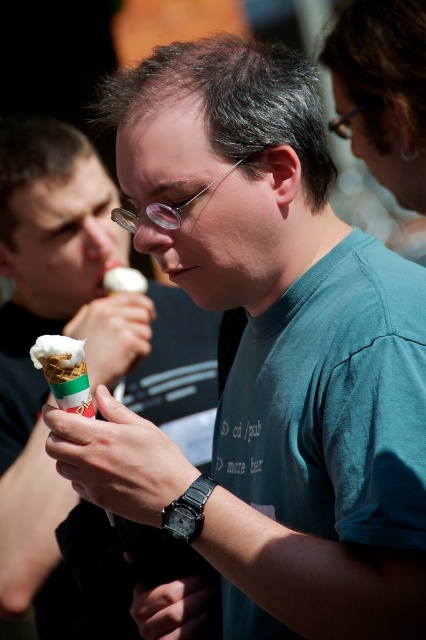
Between clear plastic glasses at center and white creamy ice cream at center, which one is positioned lower?

white creamy ice cream at center is lower down.

Is clear plastic glasses at center taller than white creamy ice cream at center?

Correct, clear plastic glasses at center is much taller as white creamy ice cream at center.

Describe the element at coordinates (183, 202) in the screenshot. The width and height of the screenshot is (426, 640). I see `clear plastic glasses at center` at that location.

At what (x,y) coordinates should I click in order to perform the action: click on clear plastic glasses at center. Please return your answer as a coordinate pair (x, y). The height and width of the screenshot is (640, 426). Looking at the image, I should click on (183, 202).

Is white creamy ice cream cone at left positioned at the back of white creamy ice cream at lower left?

That is True.

Does point (103, 253) come in front of point (80, 362)?

No, it is not.

Where is `white creamy ice cream cone at left`? This screenshot has height=640, width=426. white creamy ice cream cone at left is located at coordinates (86, 349).

Is point (135, 628) less distant than point (112, 289)?

Yes, it is in front of point (112, 289).

Can you confirm if white creamy ice cream cone at left is positioned to the right of white creamy ice cream at center?

In fact, white creamy ice cream cone at left is to the left of white creamy ice cream at center.

Does point (37, 580) lie in front of point (137, 288)?

That is True.

The height and width of the screenshot is (640, 426). In order to click on white creamy ice cream cone at left in this screenshot , I will do `click(86, 349)`.